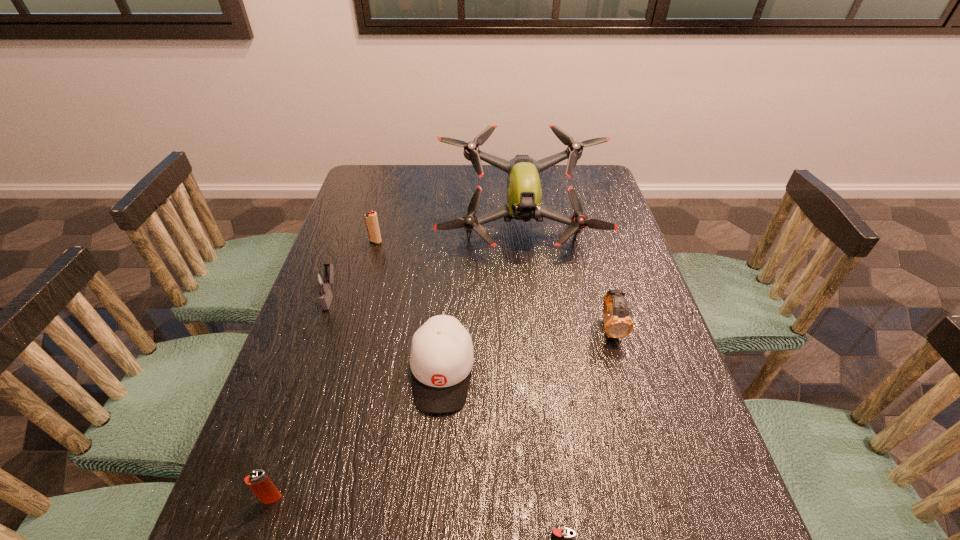
Locate an element on the screen. This screenshot has height=540, width=960. free space located on the front-facing side of the baseball cap is located at coordinates (432, 503).

The width and height of the screenshot is (960, 540). Identify the location of vacant space located 0.300m on the face of the watch. (652, 472).

I want to click on free region located 0.200m on the back of the second nearest igniter, so click(305, 396).

At what (x,y) coordinates should I click in order to perform the action: click on drone that is at the right edge. Please return your answer as a coordinate pair (x, y). This screenshot has height=540, width=960. Looking at the image, I should click on (524, 193).

Locate an element on the screen. watch present at the right edge is located at coordinates (618, 324).

This screenshot has width=960, height=540. Identify the location of vacant space at the far edge. (406, 174).

At what (x,y) coordinates should I click in order to perform the action: click on vacant space at the near edge. Please return your answer as a coordinate pair (x, y). The height and width of the screenshot is (540, 960). Looking at the image, I should click on (315, 539).

Where is `vacant space at the left edge`? vacant space at the left edge is located at coordinates coord(316,327).

Locate an element on the screen. This screenshot has width=960, height=540. blank space at the right edge is located at coordinates pos(705,489).

Image resolution: width=960 pixels, height=540 pixels. I want to click on blank region between the baseball cap and the second farthest igniter, so click(x=386, y=334).